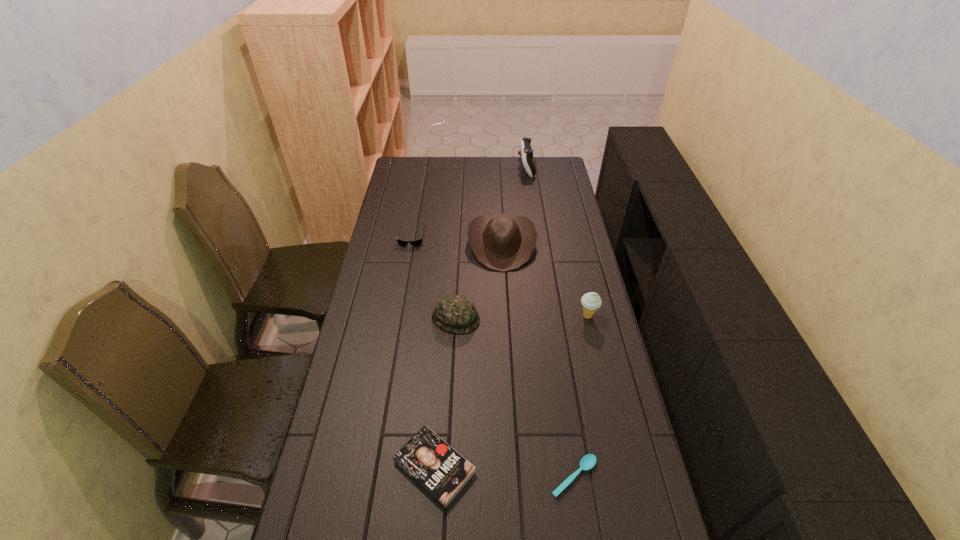
The width and height of the screenshot is (960, 540). Identify the location of icecream located at the right edge. tap(591, 301).

Identify the location of spoon at the right edge. This screenshot has width=960, height=540. (588, 461).

Locate an element on the screen. object present at the far right corner is located at coordinates (526, 152).

The width and height of the screenshot is (960, 540). I want to click on free space at the far edge of the desktop, so click(492, 163).

Locate an element on the screen. Image resolution: width=960 pixels, height=540 pixels. vacant space at the left edge of the desktop is located at coordinates click(x=418, y=215).

In the image, there is a desktop. Where is `vacant space at the right edge`? vacant space at the right edge is located at coordinates (615, 357).

At what (x,y) coordinates should I click in order to perform the action: click on free space at the far left corner. Please return your answer as a coordinate pair (x, y). Looking at the image, I should click on (423, 161).

Locate an element on the screen. Image resolution: width=960 pixels, height=540 pixels. free space between the icecream and the cowboy hat is located at coordinates [544, 280].

This screenshot has height=540, width=960. In order to click on vacant region between the rightmost object and the farthest object in this screenshot , I will do `click(557, 242)`.

Where is `vacant space in between the farthest object and the cowboy hat`? vacant space in between the farthest object and the cowboy hat is located at coordinates (514, 206).